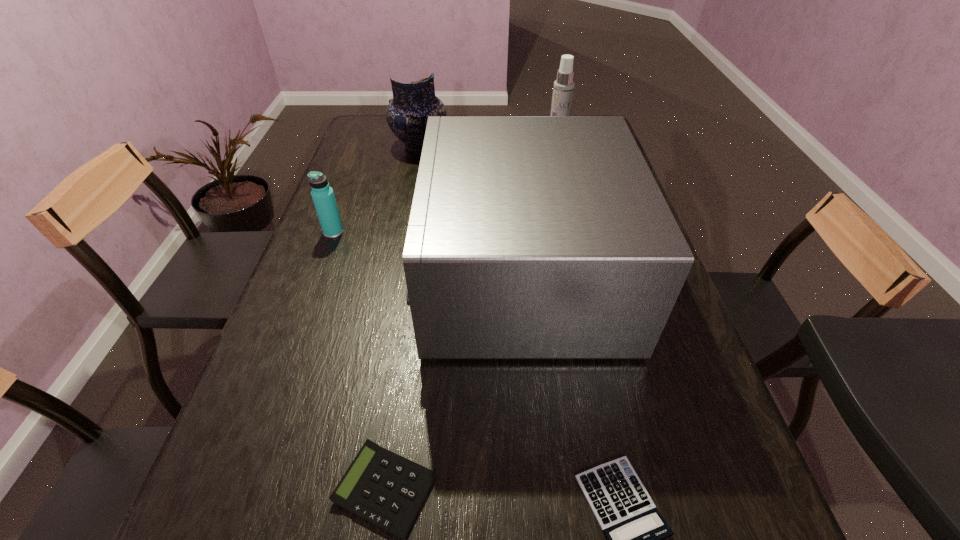
Select which object is the fourth closest to the pottery. Please provide its 2D coordinates. Your answer should be formatted as a tuple, i.e. [(x, y)], where the tuple contains the x and y coordinates of a point satisfying the conditions above.

[(380, 486)]